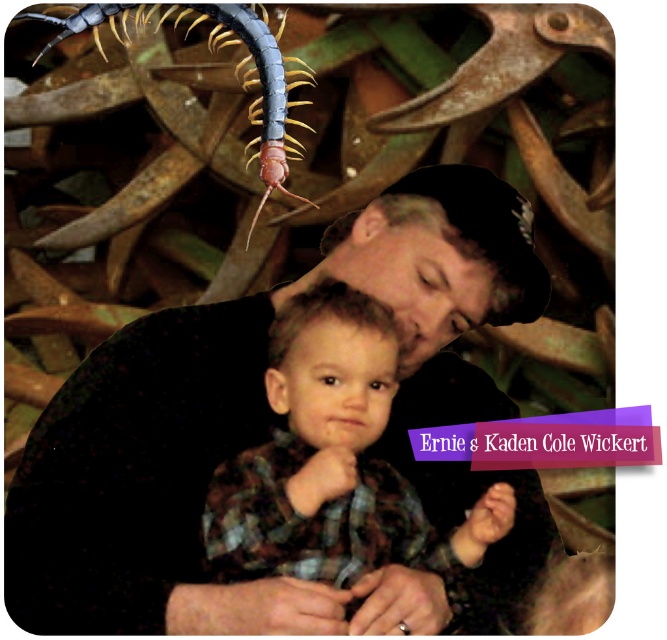
Does plaid fabric shirt at center have a lesser height compared to gray matte centipede at upper left?

In fact, plaid fabric shirt at center may be taller than gray matte centipede at upper left.

Does point (229, 561) come behind point (293, 196)?

No, it is in front of (293, 196).

This screenshot has width=667, height=640. In order to click on plaid fabric shirt at center in this screenshot , I will do click(334, 461).

Is black matte shirt at center thinner than gray matte centipede at upper left?

Incorrect, black matte shirt at center's width is not less than gray matte centipede at upper left's.

Find the location of a particular element. This screenshot has height=640, width=667. black matte shirt at center is located at coordinates (267, 432).

Between black matte shirt at center and plaid fabric shirt at center, which one appears on the right side from the viewer's perspective?

Positioned to the right is plaid fabric shirt at center.

Which is in front, point (384, 227) or point (319, 529)?

Point (319, 529)

The height and width of the screenshot is (640, 667). What do you see at coordinates (267, 432) in the screenshot?
I see `black matte shirt at center` at bounding box center [267, 432].

Where is `black matte shirt at center`? This screenshot has height=640, width=667. black matte shirt at center is located at coordinates (267, 432).